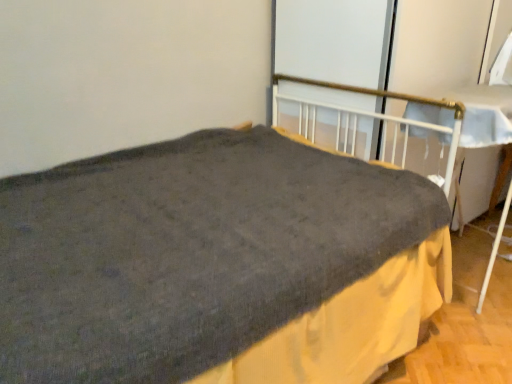
Locate an element on the screen. dark gray fabric bed at center is located at coordinates (214, 263).

What do you see at coordinates (214, 263) in the screenshot? I see `dark gray fabric bed at center` at bounding box center [214, 263].

This screenshot has height=384, width=512. I want to click on dark gray fabric bed at center, so click(x=214, y=263).